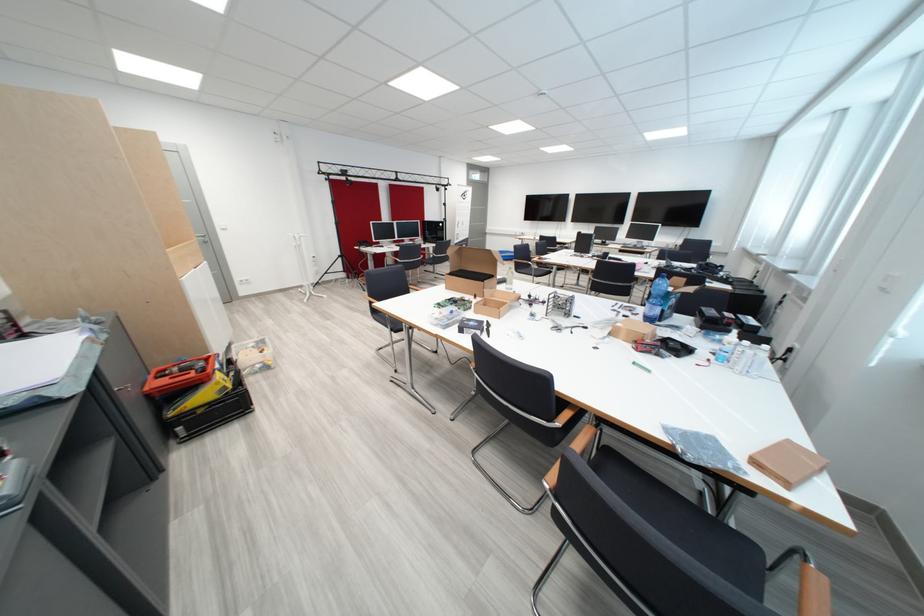
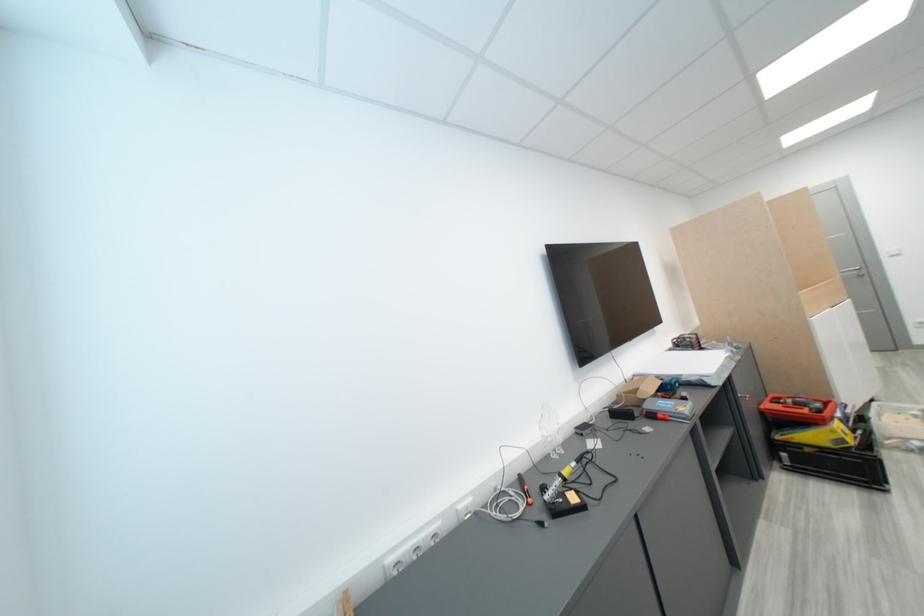
Locate, in the second image, the point that corresponds to (x=199, y=432) in the first image.

(803, 463)